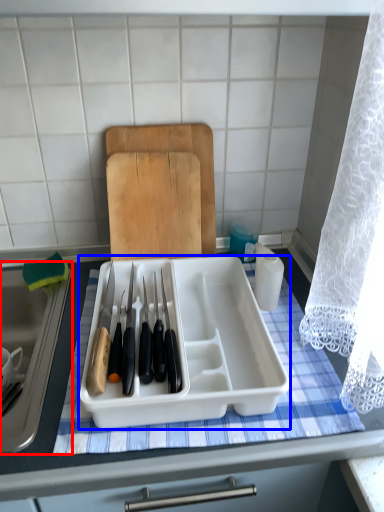
Question: Which object is further to the camera taking this photo, sink (highlighted by a red box) or kitchen appliance (highlighted by a blue box)?

Choices:
 (A) sink
 (B) kitchen appliance

Answer: (B)